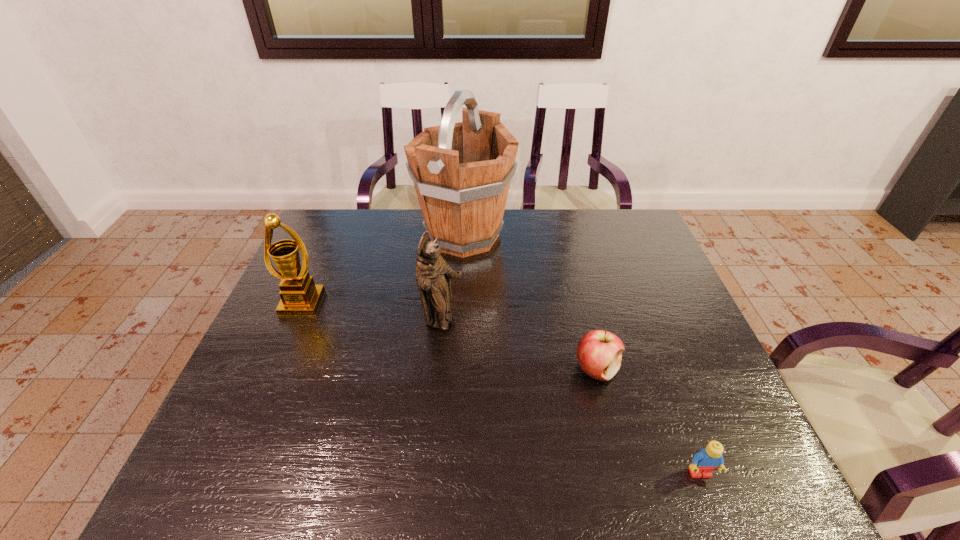
Where is `vacant region located on the front-facing side of the figurine`? This screenshot has height=540, width=960. vacant region located on the front-facing side of the figurine is located at coordinates (497, 321).

Where is `free spot located 0.230m on the right of the fourth object from left to right`? free spot located 0.230m on the right of the fourth object from left to right is located at coordinates (716, 369).

At what (x,y) coordinates should I click in order to perform the action: click on object positioned at the far edge. Please return your answer as a coordinate pair (x, y). This screenshot has height=540, width=960. Looking at the image, I should click on (461, 172).

I want to click on object situated at the near edge, so click(x=708, y=459).

I want to click on object that is at the left edge, so click(x=300, y=296).

The width and height of the screenshot is (960, 540). I want to click on object located in the right edge section of the desktop, so click(x=708, y=459).

Identify the location of object positioned at the near right corner. This screenshot has width=960, height=540. (708, 459).

What are the coordinates of `free space at the far edge of the desktop` in the screenshot? It's located at (508, 213).

The width and height of the screenshot is (960, 540). Find the location of `free space at the near edge of the desktop`. free space at the near edge of the desktop is located at coordinates (283, 480).

This screenshot has width=960, height=540. Find the location of `vacant space at the left edge of the desktop`. vacant space at the left edge of the desktop is located at coordinates (309, 264).